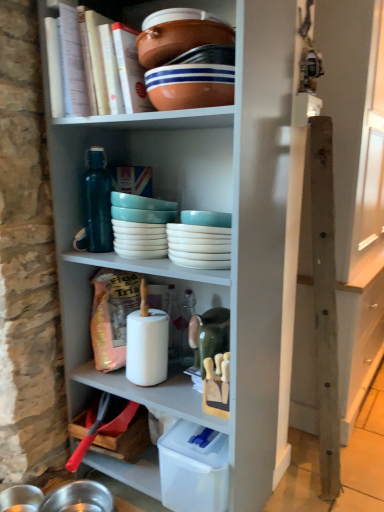
Identify the location of vacant region above brown ceramic bowl at upper center, the 1th bowl when ordered from top to bottom (from a real-world perspective). The image size is (384, 512). (180, 15).